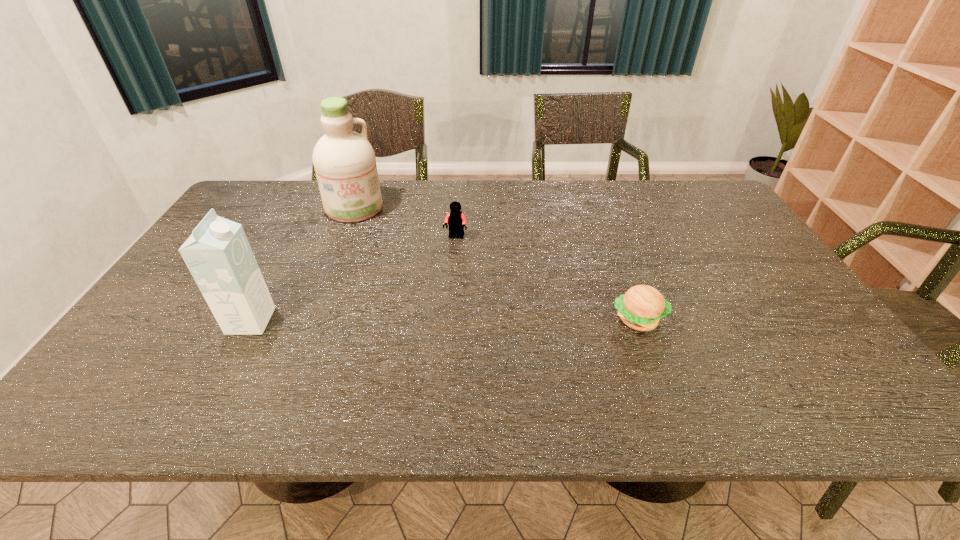
Identify the location of free space at the right edge of the desktop. The width and height of the screenshot is (960, 540). click(x=707, y=232).

Identify the location of vacant space at the far left corner. This screenshot has width=960, height=540. (276, 182).

In the image, there is a desktop. Identify the location of vacant space at the far right corner. (671, 187).

Identify the location of free space that is in between the rightmost object and the second tallest object. [x=444, y=320].

What are the coordinates of `vacant space that is in between the farthest object and the second farthest object` in the screenshot? It's located at (405, 222).

The image size is (960, 540). What are the coordinates of `vacant space that is in between the rightmost object and the tallest object` in the screenshot? It's located at (496, 264).

Locate an element on the screen. Image resolution: width=960 pixels, height=540 pixels. vacant space that's between the carton and the tallest object is located at coordinates (302, 265).

Locate an element on the screen. The width and height of the screenshot is (960, 540). blank region between the shortest object and the tallest object is located at coordinates (496, 264).

Where is `blank region between the second object from left to right and the second object from right to left`? This screenshot has width=960, height=540. blank region between the second object from left to right and the second object from right to left is located at coordinates [x=405, y=222].

I want to click on vacant space that is in between the third object from left to right and the second tallest object, so click(353, 279).